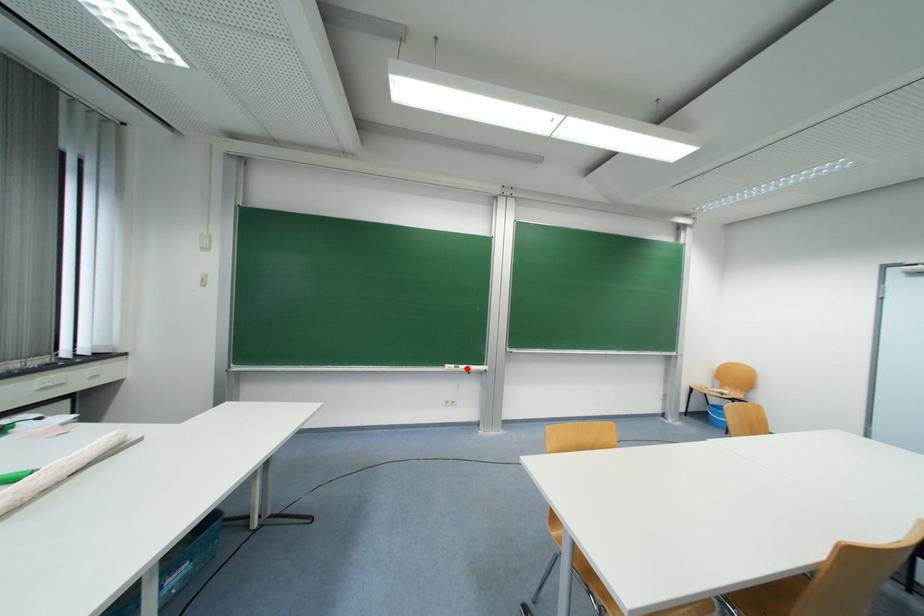
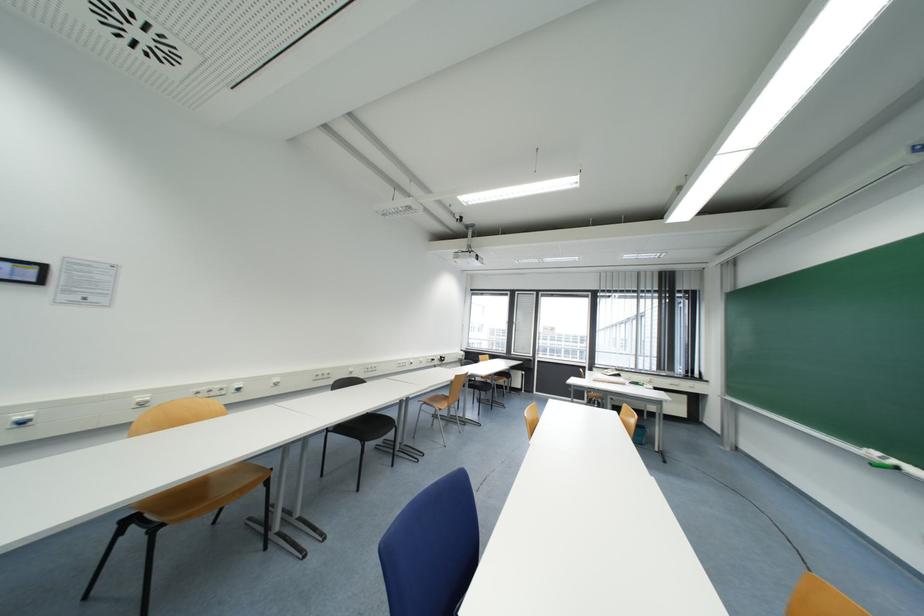
Question: I am providing you with two images of the same scene from different viewpoints. In image1, a red point is highlighted. Considering the same 3D point in image2, which of the following is correct?

Choices:
 (A) It is closer
 (B) It is farther

Answer: (A)